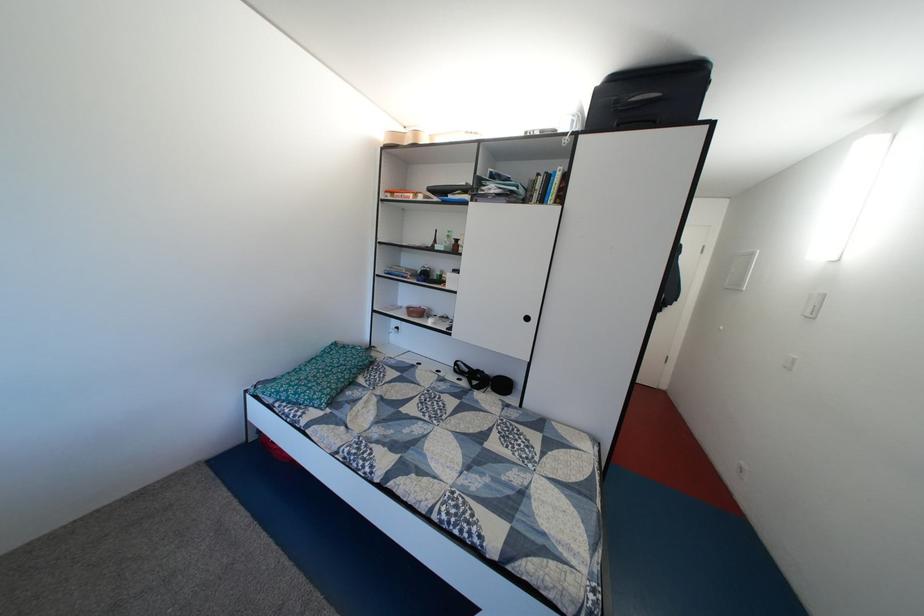
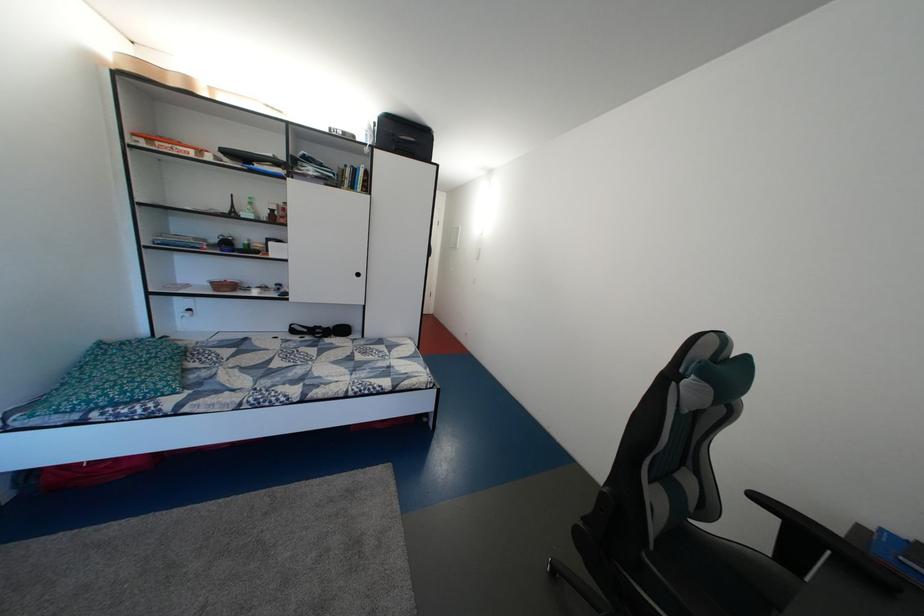
The point at (x=337, y=383) is marked in the first image. Where is the corresponding point in the second image?

(160, 376)